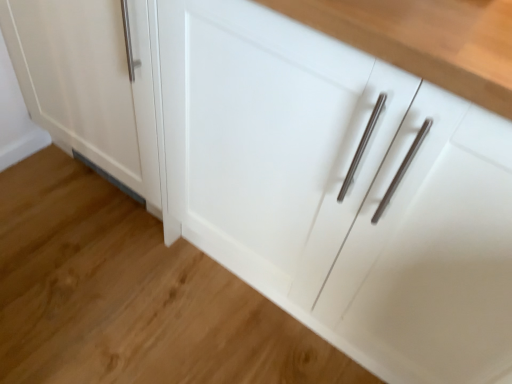
At what (x,y) coordinates should I click in order to perform the action: click on free point above white glossy cabinet handle at center (from a real-world perspective). Please return your answer as a coordinate pair (x, y). The image size is (512, 384). Looking at the image, I should click on (142, 278).